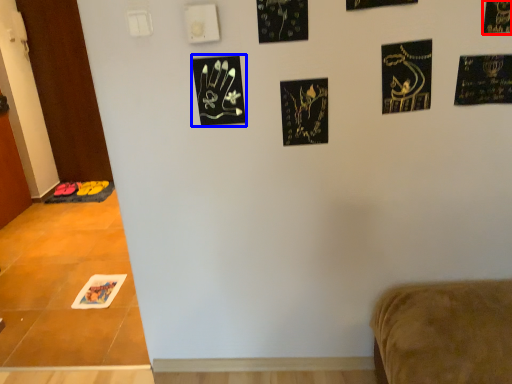
Question: Which object is closer to the camera taking this photo, print (highlighted by a red box) or print (highlighted by a blue box)?

Choices:
 (A) print
 (B) print

Answer: (A)